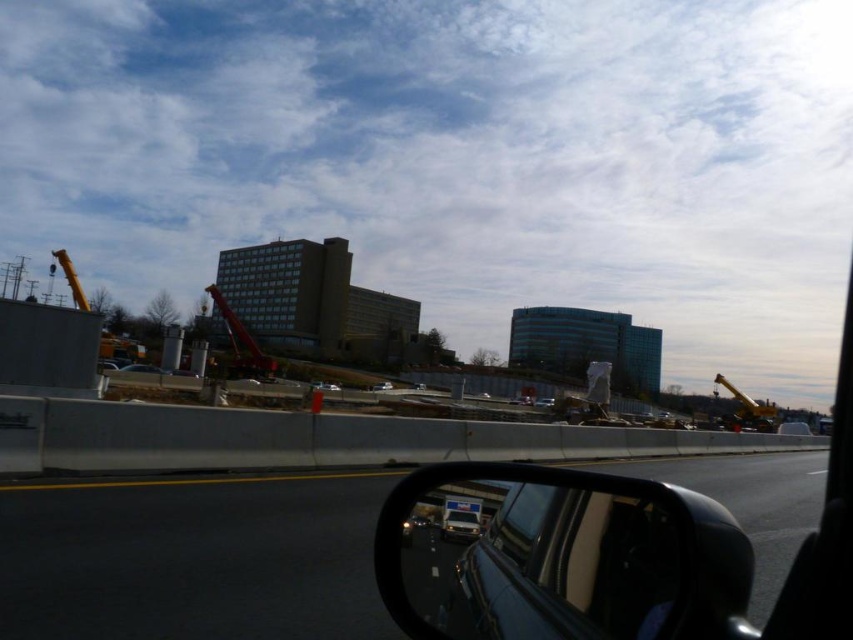
Question: Is black glossy rearview mirror at lower right positioned in front of metallic silver car at lower center?

Choices:
 (A) no
 (B) yes

Answer: (B)

Question: Among these objects, which one is farthest from the camera?

Choices:
 (A) yellow metallic crane at right
 (B) clear glass window at lower right

Answer: (A)

Question: Which object is farther from the camera taking this photo?

Choices:
 (A) metallic red crane at center
 (B) black glossy rearview mirror at lower right
 (C) metallic silver car at lower center

Answer: (A)

Question: Which point appears closest to the camera in this image?

Choices:
 (A) (527, 540)
 (B) (440, 522)

Answer: (A)

Question: Does black glossy highway at lower left have a lesser width compared to metallic red crane at center?

Choices:
 (A) yes
 (B) no

Answer: (B)

Question: Does clear glass window at lower right lie in front of metallic silver car at lower center?

Choices:
 (A) yes
 (B) no

Answer: (A)